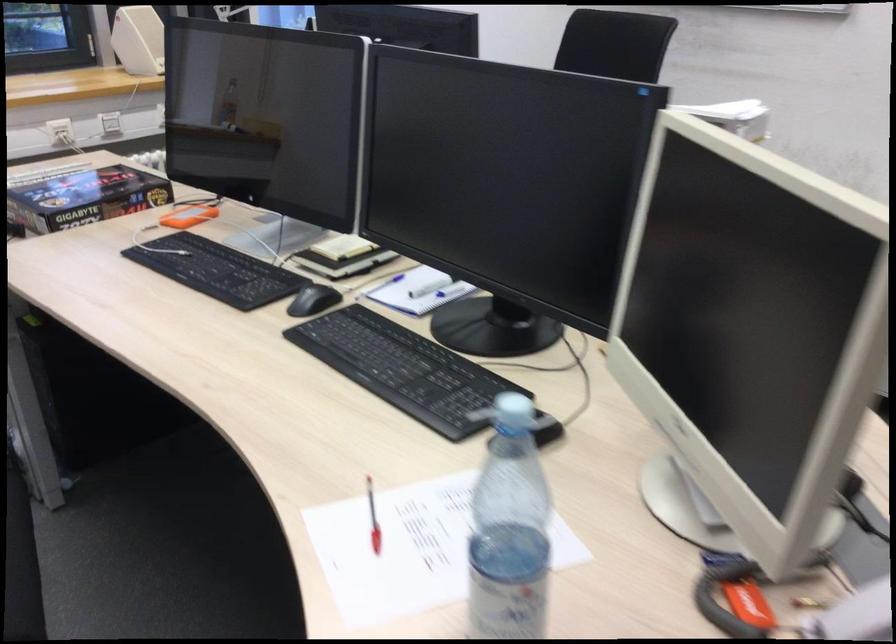
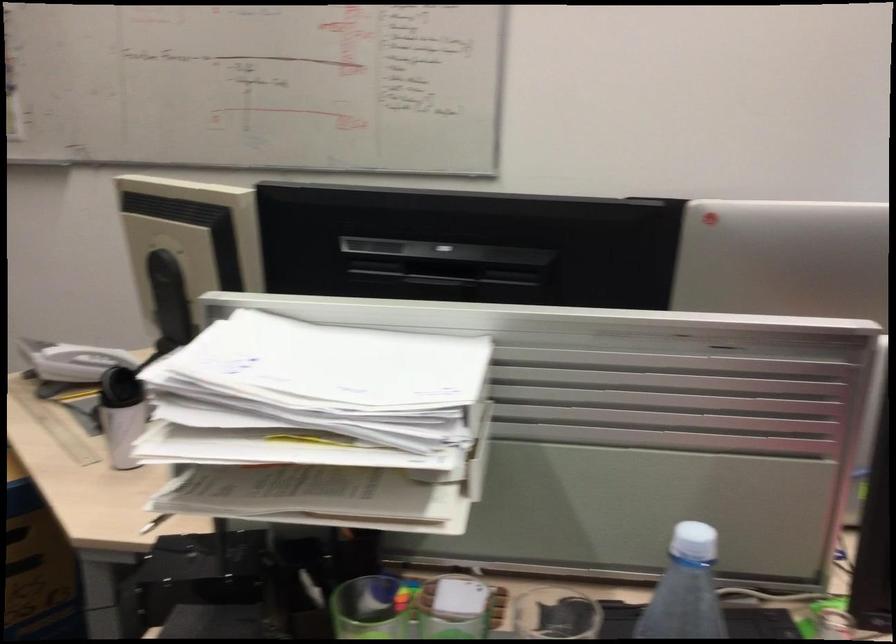
Question: I am providing you with two images of the same scene from different viewpoints. Please identify which objects are invisible in image2.

Choices:
 (A) clear pitcher handle
 (B) white telephone handset
 (C) white smartphone
 (D) spiral bound notebook

Answer: (D)